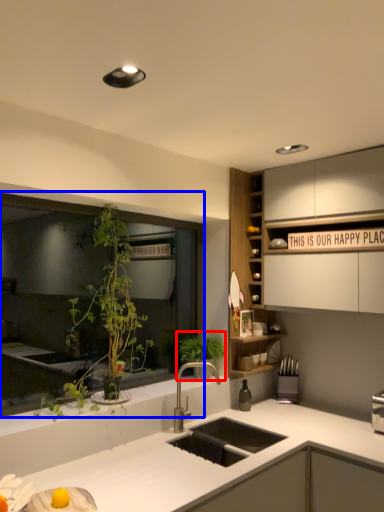
Question: Among these objects, which one is nearest to the camera, vegetation (highlighted by a red box) or window (highlighted by a blue box)?

Choices:
 (A) vegetation
 (B) window

Answer: (B)